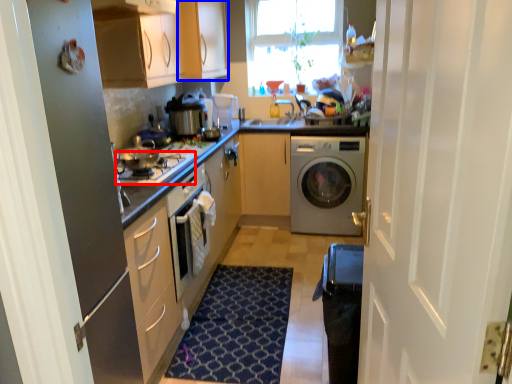
Question: Among these objects, which one is nearest to the camera, gas stove (highlighted by a red box) or cabinetry (highlighted by a blue box)?

Choices:
 (A) gas stove
 (B) cabinetry

Answer: (A)